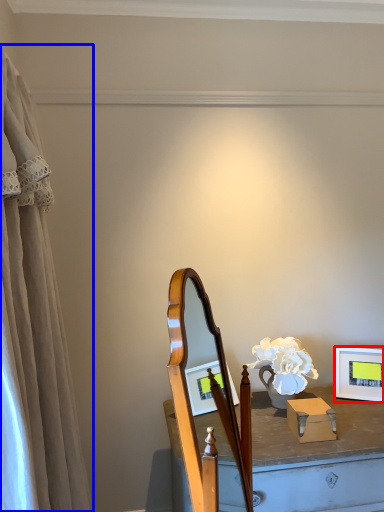
Question: Which point is further to the camera, picture frame (highlighted by a red box) or curtain (highlighted by a blue box)?

Choices:
 (A) picture frame
 (B) curtain

Answer: (A)